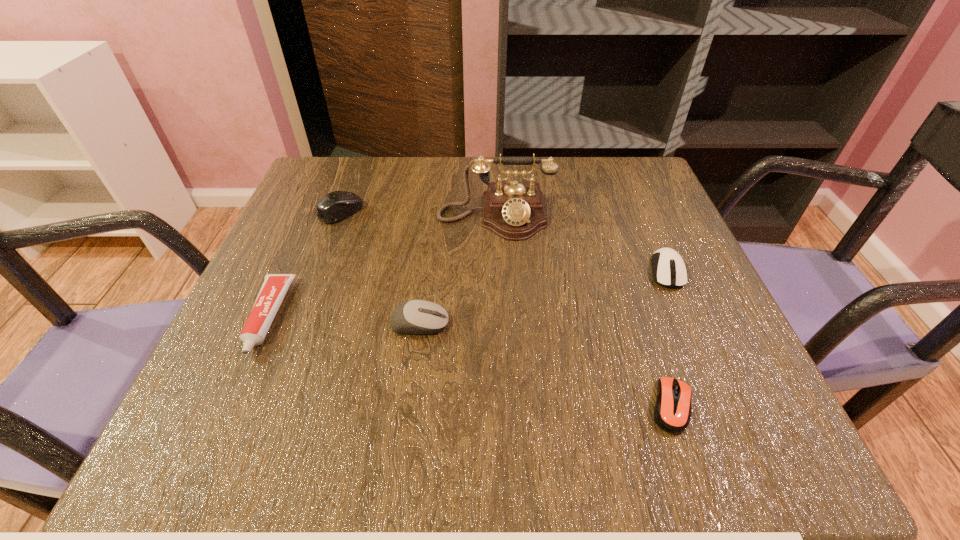
Identify the location of object at the near right corner. This screenshot has width=960, height=540. (672, 413).

What are the coordinates of `vacant space at the far edge of the desktop` in the screenshot? It's located at (422, 201).

You are a GUI agent. You are given a task and a screenshot of the screen. Output one action in this format:
    pyautogui.click(x=<x>, y=<y>)
    Task: Click on the vacant space at the left edge
    The height and width of the screenshot is (540, 960).
    Given the screenshot: What is the action you would take?
    pyautogui.click(x=319, y=298)

Identify the location of vacant space at the right edge of the desktop. The width and height of the screenshot is (960, 540). (647, 311).

Where is `vacant space at the far left corner of the desktop`? The image size is (960, 540). vacant space at the far left corner of the desktop is located at coordinates (335, 185).

The width and height of the screenshot is (960, 540). In order to click on free space at the far right corner in this screenshot , I will do `click(646, 167)`.

This screenshot has width=960, height=540. I want to click on vacant point located between the toothpaste and the farthest computer mouse, so click(304, 265).

I want to click on free space between the telephone and the shortest computer mouse, so click(584, 312).

Image resolution: width=960 pixels, height=540 pixels. Find the location of `free space that is in between the farthest computer mouse and the toothpaste`. free space that is in between the farthest computer mouse and the toothpaste is located at coordinates (304, 265).

Find the location of a particular element. The height and width of the screenshot is (540, 960). vacant space in between the telephone and the nearest computer mouse is located at coordinates (584, 312).